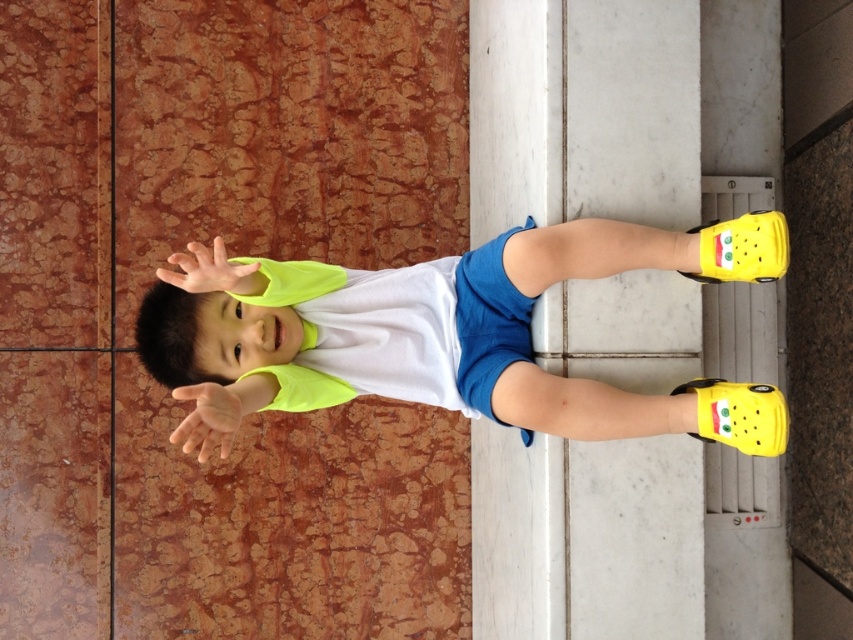
Question: Which point is farther from the camera taking this photo?

Choices:
 (A) (606, 458)
 (B) (315, 365)

Answer: (B)

Question: Is white smooth pillar at center thinner than yellow matte shoes at lower right?

Choices:
 (A) yes
 (B) no

Answer: (A)

Question: Which point appears farthest from the camera in this image?

Choices:
 (A) (550, 246)
 (B) (693, 458)

Answer: (B)

Question: Is white smooth pillar at center smaller than yellow matte shoes at lower right?

Choices:
 (A) no
 (B) yes

Answer: (A)

Question: Does white smooth pillar at center appear on the left side of yellow matte shoes at lower right?

Choices:
 (A) yes
 (B) no

Answer: (B)